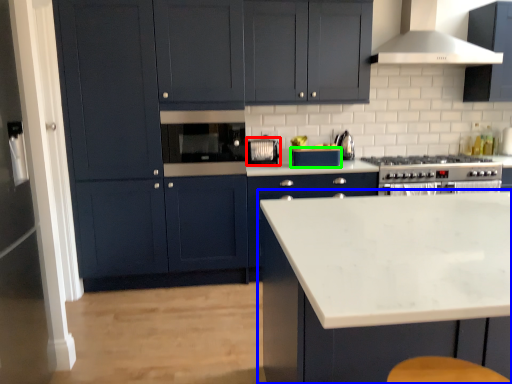
Question: Based on their relative distances, which object is farther from appliance (highlighted by a red box)? Choose from cabinetry (highlighted by a blue box) and appliance (highlighted by a green box).

Choices:
 (A) cabinetry
 (B) appliance

Answer: (A)